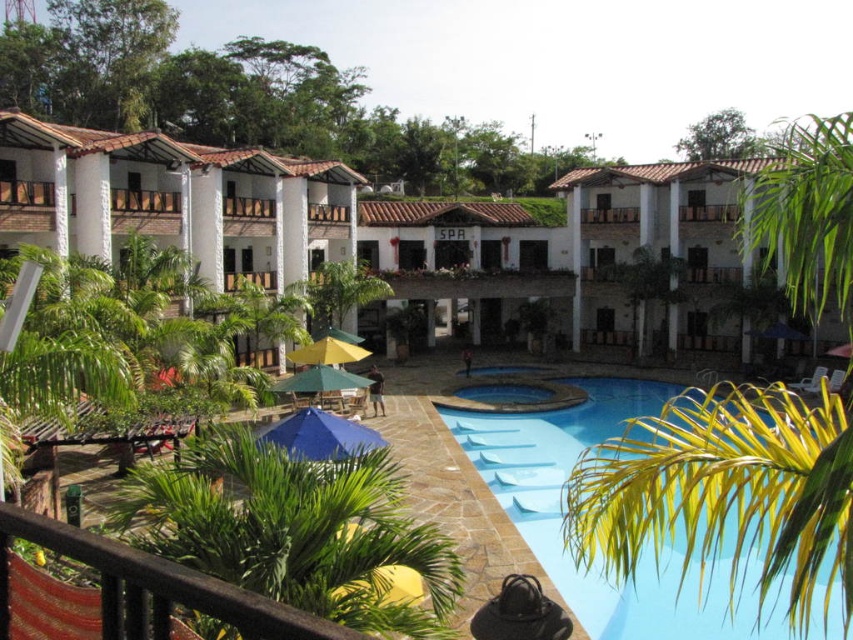
Which is more to the left, white stucco building at upper left or wooden balcony at upper right?

white stucco building at upper left

Which is in front, point (235, 204) or point (720, 212)?

Point (235, 204) is in front.

What do you see at coordinates (173, 200) in the screenshot? The height and width of the screenshot is (640, 853). I see `white stucco building at upper left` at bounding box center [173, 200].

This screenshot has width=853, height=640. What are the coordinates of `white stucco building at upper left` in the screenshot? It's located at (173, 200).

Looking at this image, can you confirm if white stucco building at upper left is positioned above blue smooth pool at center?

Yes.

Which is below, white stucco building at upper left or blue smooth pool at center?

Positioned lower is blue smooth pool at center.

Which is in front, point (241, 241) or point (495, 493)?

Point (495, 493) is more forward.

The height and width of the screenshot is (640, 853). Identify the location of white stucco building at upper left. (173, 200).

Does point (300, 262) come in front of point (630, 214)?

Yes, point (300, 262) is in front of point (630, 214).

Is point (167, 172) more distant than point (618, 216)?

No, (167, 172) is in front of (618, 216).

Between point (318, 260) and point (618, 221), which one is positioned in front?

Point (618, 221) is in front.

Find the location of a particular element. white stucco building at upper left is located at coordinates (173, 200).